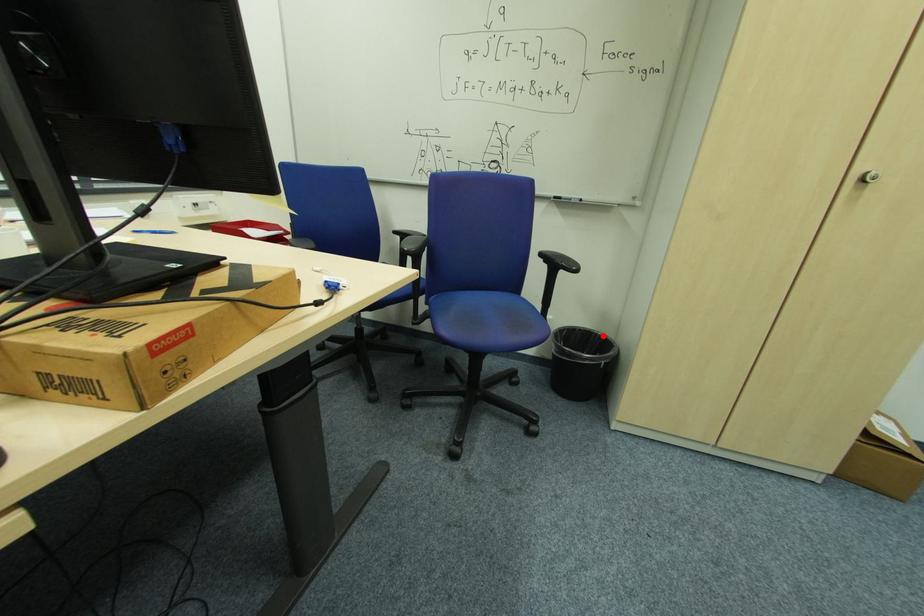
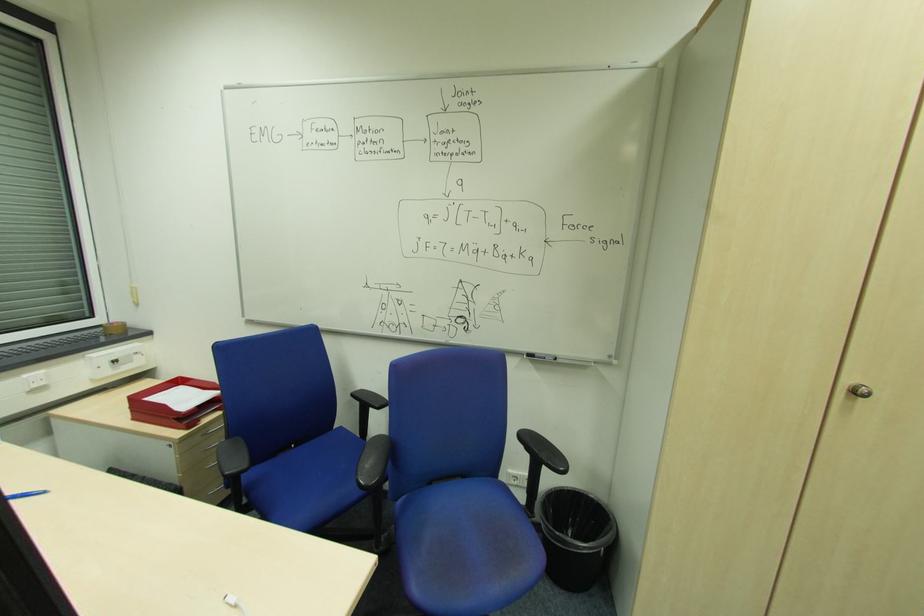
Question: I am providing you with two images of the same scene from different viewpoints. A red point is marked on the first image. Is the red point's position out of view in image 2?

Choices:
 (A) Yes
 (B) No

Answer: (B)